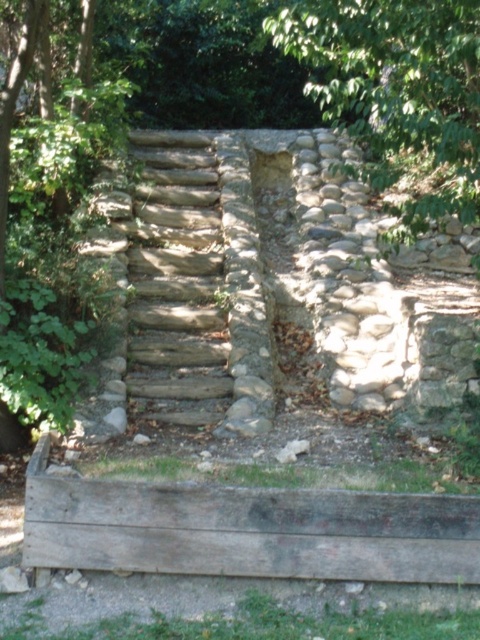
You are standing at the bottom of the stone staircase in the rustic outdoor scene. You notice a point marked at coordinate (247, 531). What is the object located at this point?

The point at coordinate (247, 531) marks weathered wood at lower center.

You are carrying a heavy backpack and need to choose between stepping onto the weathered wood at lower center or the natural stone stairs at center. Which option provides a more stable footing based on their sizes?

The natural stone stairs at center are larger than the weathered wood at lower center, so they provide a more stable footing.